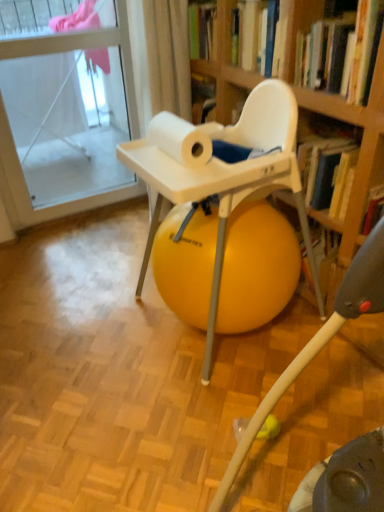
The image size is (384, 512). In order to click on free space in front of yellow rubber ball at center in this screenshot , I will do `click(226, 415)`.